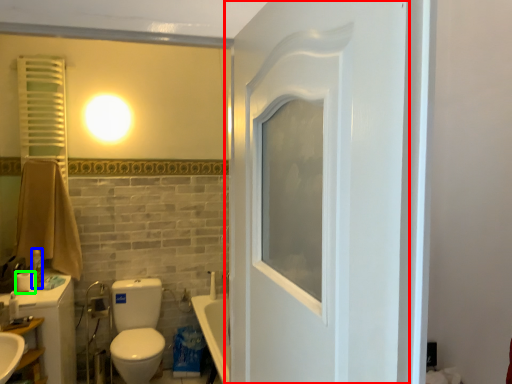
Question: Which is farther away from door (highlighted by a red box)? toiletry (highlighted by a blue box) or toilet paper (highlighted by a green box)?

Choices:
 (A) toiletry
 (B) toilet paper

Answer: (A)